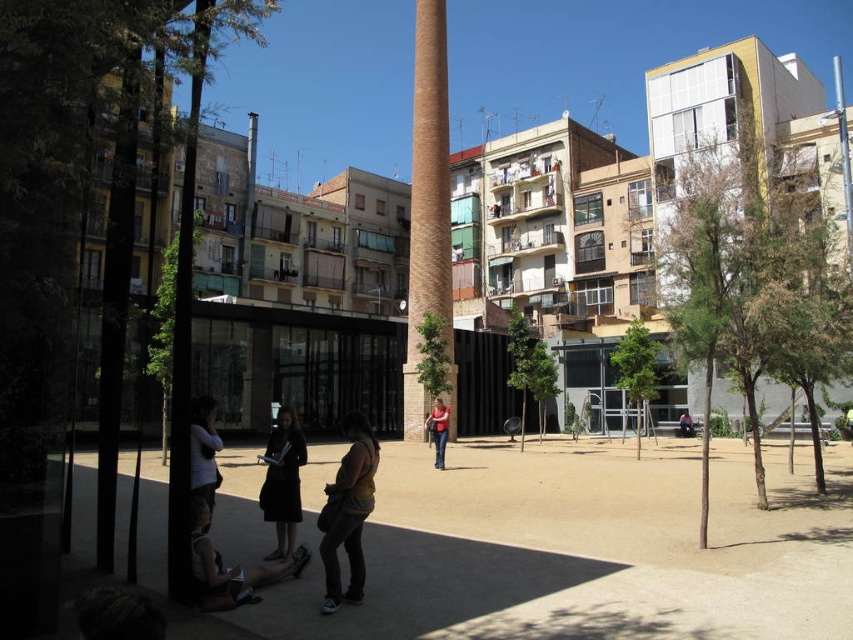
Question: Based on their relative distances, which object is farther from the dark brown leather shoes at lower center?

Choices:
 (A) dark matte dress at center
 (B) dark brown leather jacket at center
 (C) matte black jacket at center
 (D) pink fabric at center

Answer: (D)

Question: Which point is farther to the camera?

Choices:
 (A) (329, 608)
 (B) (277, 476)

Answer: (B)

Question: Is dark brown leather shoes at lower center below pink fabric at center?

Choices:
 (A) no
 (B) yes

Answer: (A)

Question: Does dark matte dress at center have a larger size compared to matte black dress at lower left?

Choices:
 (A) no
 (B) yes

Answer: (B)

Question: Which of the following is the farthest from the observer?

Choices:
 (A) coord(234,596)
 (B) coord(345,419)
 (C) coord(277,550)

Answer: (C)

Question: Observing the image, what is the correct spatial positioning of matte black dress at lower left in reference to matte black jacket at center?

Choices:
 (A) below
 (B) above

Answer: (B)